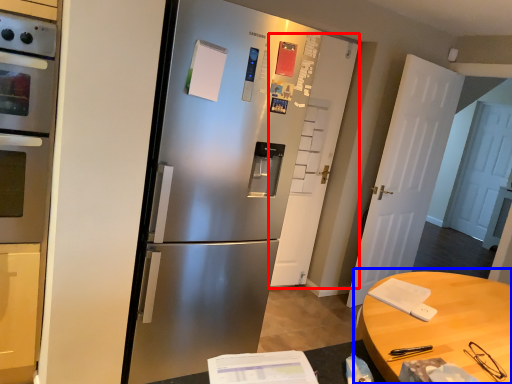
Question: Which point is closer to the camera, door (highlighted by a red box) or table (highlighted by a blue box)?

Choices:
 (A) door
 (B) table

Answer: (B)